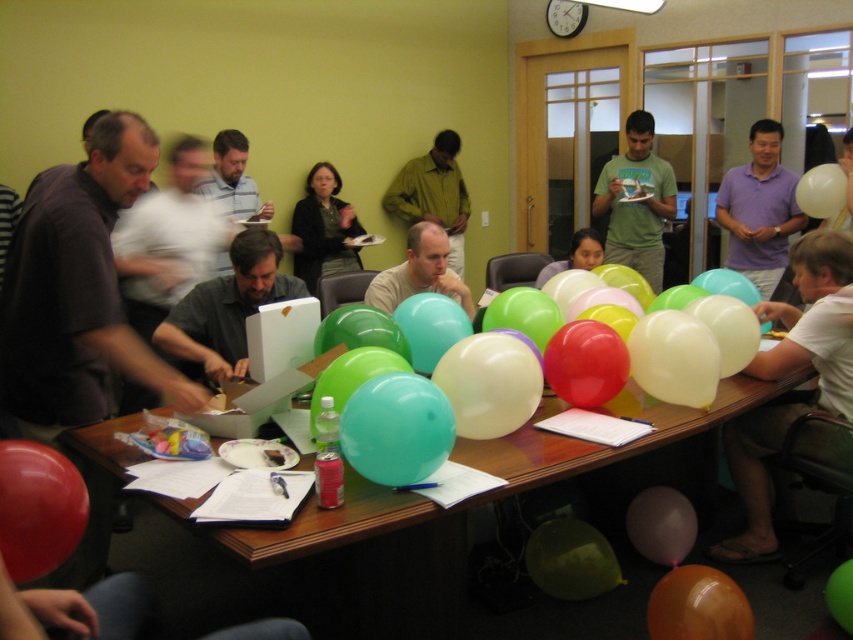
Is teal glossy balloon at center smaller than matte green shirt at center?

Correct, teal glossy balloon at center occupies less space than matte green shirt at center.

Where is `teal glossy balloon at center`? Image resolution: width=853 pixels, height=640 pixels. teal glossy balloon at center is located at coordinates (396, 428).

Does purple matte shirt at upper right have a greater width compared to translucent purple balloon at lower center?

Indeed, purple matte shirt at upper right has a greater width compared to translucent purple balloon at lower center.

Can you confirm if purple matte shirt at upper right is positioned to the left of translucent purple balloon at lower center?

No, purple matte shirt at upper right is not to the left of translucent purple balloon at lower center.

What do you see at coordinates (759, 209) in the screenshot? I see `purple matte shirt at upper right` at bounding box center [759, 209].

Locate an element on the screen. The width and height of the screenshot is (853, 640). purple matte shirt at upper right is located at coordinates (759, 209).

Is point (38, 468) positioned behind point (297, 204)?

No.

Which is in front, point (15, 564) or point (325, 205)?

Point (15, 564)

This screenshot has width=853, height=640. Identify the location of rubberized red balloon at lower left. point(38,508).